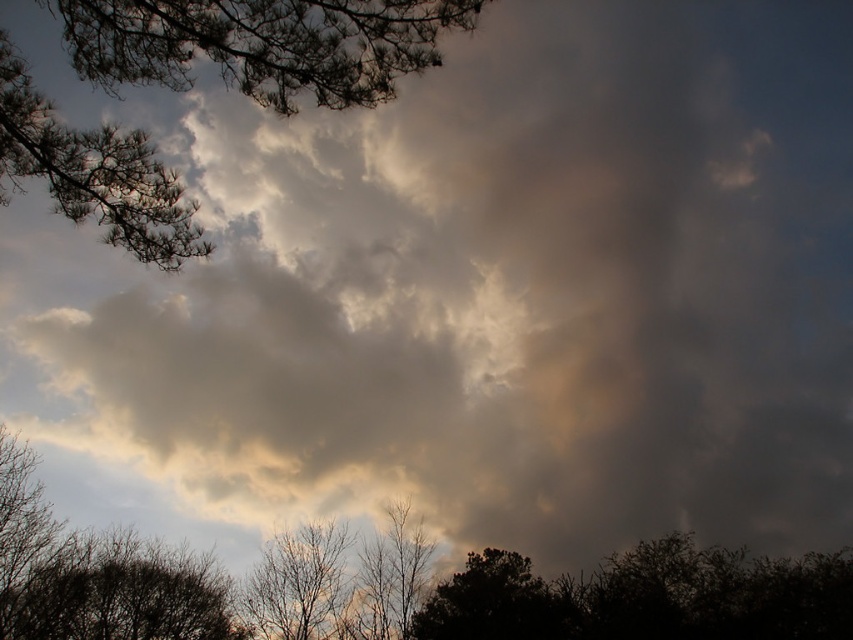
Does dark brown bark tree at center appear over brown textured tree at lower center?

Incorrect, dark brown bark tree at center is not positioned above brown textured tree at lower center.

This screenshot has height=640, width=853. Describe the element at coordinates (390, 586) in the screenshot. I see `dark brown bark tree at center` at that location.

Is point (35, 460) farther from viewer compared to point (335, 604)?

Yes, it is behind point (335, 604).

Find the location of a particular element. This screenshot has width=853, height=640. dark brown bark tree at center is located at coordinates (390, 586).

Which is above, brown textured branches at upper left or dark green leafy tree at bottom?

Positioned higher is brown textured branches at upper left.

Which of these two, brown textured branches at upper left or dark green leafy tree at bottom, stands taller?

dark green leafy tree at bottom is taller.

Which is in front, point (131, 164) or point (564, 596)?

Point (131, 164) is in front.

This screenshot has width=853, height=640. What are the coordinates of `brown textured branches at upper left` in the screenshot? It's located at (260, 44).

Is point (256, 28) less distant than point (62, 628)?

Yes, point (256, 28) is closer to viewer.

In order to click on brown textured branches at upper left in this screenshot , I will do `click(260, 44)`.

I want to click on brown textured branches at upper left, so click(x=260, y=44).